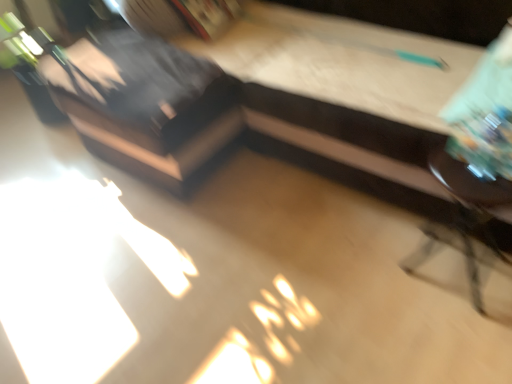
Locate an element on the screen. Image resolution: width=512 pixels, height=384 pixels. vacant space in front of metallic dark brown swivel chair at right is located at coordinates (461, 336).